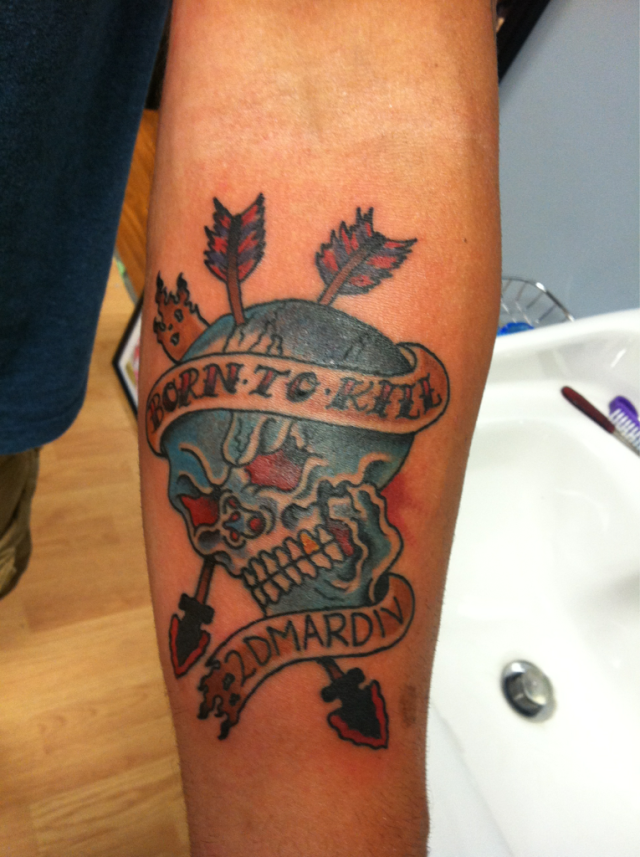
Where is `basin`? basin is located at coordinates (563, 775).